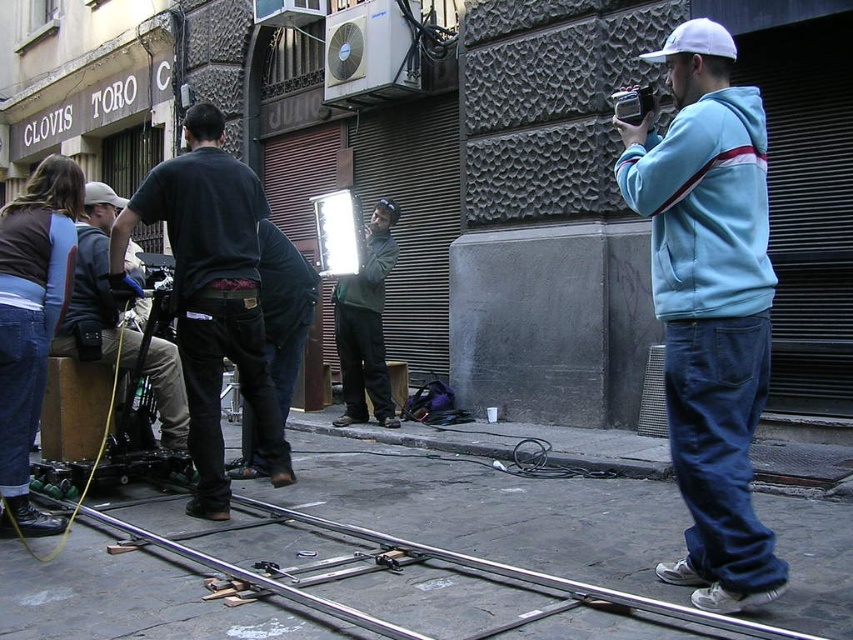
You are a costume designer observing the film crew setup. You need to determine if the light blue hoodie at right can be stored in a bag designed to hold the black plastic video camera at right. Based on their sizes, what would you advise?

The light blue hoodie at right is bigger than the black plastic video camera at right, so it won not fit into a bag designed for the camera.

You are a film crew member who needs to set up a tripod between the light blue hoodie at right and the black plastic video camera at right. Which object should you place the tripod closer to to ensure it is stable? The answer should be based on their heights.

The light blue hoodie at right is much taller than the black plastic video camera at right, so placing the tripod closer to the light blue hoodie at right would provide better stability due to its height.

You are a film crew member who needs to move the green fabric jacket at center to access the metallic silver train track at lower center. Is the jacket currently blocking the track?

The metallic silver train track at lower center is positioned under the green fabric jacket at center, so yes, the jacket is blocking the track and needs to be moved to access it.